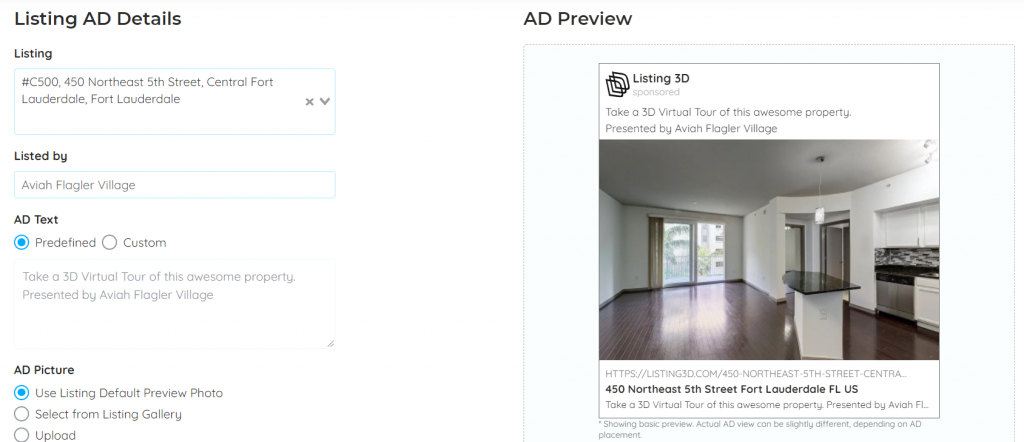
Locate an element on the screen. ceiling is located at coordinates (703, 158).